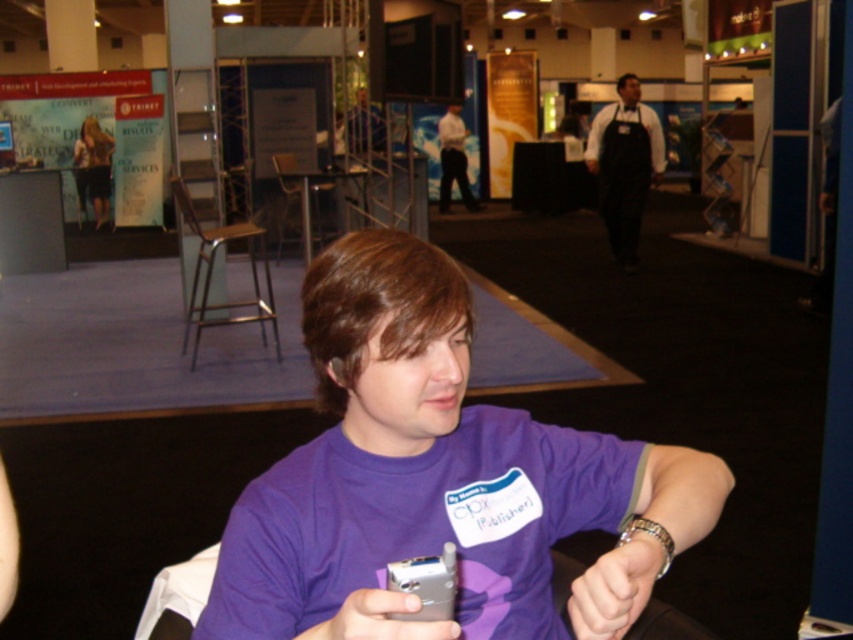
You are a photographer at the convention and need to take a photo of the purple fabric shirt at center. Your camera is 26.12 inches away from the shirt. Is the distance sufficient to capture the entire shirt in the frame?

The purple fabric shirt at center and camera are 26.12 inches apart from each other. The distance of 26.12 inches is sufficient to capture the entire shirt in the frame as it allows for proper framing without being too close.

You are a photographer at the convention and want to capture both the black apron at right and the matte black dress at upper left in a single photo. Which object should you focus on first to ensure both are in frame?

The black apron at right is much taller than the matte black dress at upper left, so you should focus on the black apron at right first to ensure both are in frame.

You are standing at the camera position and want to reach the point marked as point (x=271, y=637). If your stride length is 28 inches, how many steps would it take you to reach that point?

The distance between point (x=271, y=637) and the camera is 32.78 inches. Since each step is 28 inches, you would need approximately 2 steps to reach the point.